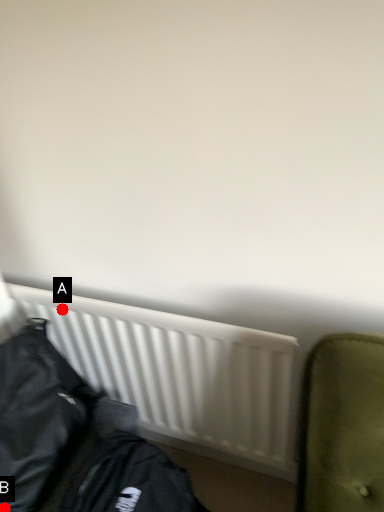
Question: Two points are circled on the image, labeled by A and B beside each circle. Among these points, which one is farthest from the camera?

Choices:
 (A) A is further
 (B) B is further

Answer: (A)